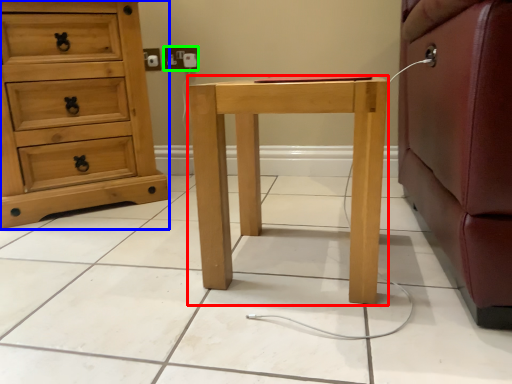
Question: Considering the real-world distances, which object is farthest from nightstand (highlighted by a red box)? chest of drawers (highlighted by a blue box) or electric outlet (highlighted by a green box)?

Choices:
 (A) chest of drawers
 (B) electric outlet

Answer: (B)